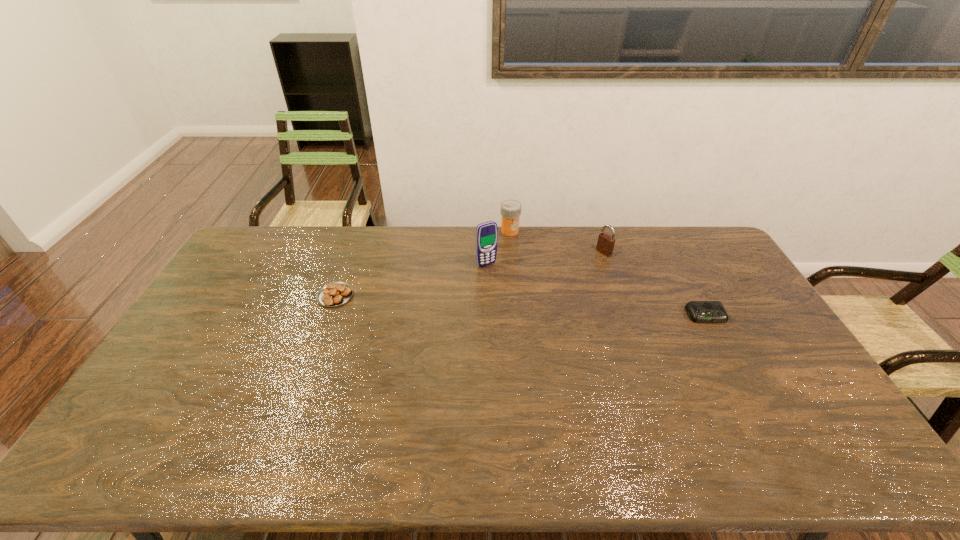
Where is `vacant region located 0.260m on the front-facing side of the padlock`? vacant region located 0.260m on the front-facing side of the padlock is located at coordinates (549, 284).

In order to click on blank space located 0.150m on the front-facing side of the padlock in this screenshot , I will do `click(571, 271)`.

Find the location of a particular element. Image resolution: width=960 pixels, height=540 pixels. vacant area located 0.260m on the front-facing side of the padlock is located at coordinates (549, 284).

This screenshot has height=540, width=960. Find the location of `vacant area located on the label side of the farthest object`. vacant area located on the label side of the farthest object is located at coordinates (517, 254).

Where is `free space located on the label side of the farthest object`? Image resolution: width=960 pixels, height=540 pixels. free space located on the label side of the farthest object is located at coordinates (524, 273).

This screenshot has width=960, height=540. Identify the location of vacant space positioned on the label side of the farthest object. (531, 292).

You are a GUI agent. You are given a task and a screenshot of the screen. Output one action in this format:
    pyautogui.click(x=<x>, y=<y>)
    Task: Click on the vacant space located 0.180m on the front-facing side of the cellular telephone
    This screenshot has height=540, width=960.
    Given the screenshot: What is the action you would take?
    pyautogui.click(x=515, y=300)

Locate an element on the screen. vacant space located 0.240m on the front-facing side of the cellular telephone is located at coordinates (523, 312).

You are a GUI agent. You are given a task and a screenshot of the screen. Output one action in this format:
    pyautogui.click(x=<x>, y=<y>)
    Task: Click on the free spot located 0.190m on the front-facing side of the cellular telephone
    The width and height of the screenshot is (960, 540).
    Given the screenshot: What is the action you would take?
    pyautogui.click(x=516, y=302)

Locate an element on the screen. The width and height of the screenshot is (960, 540). padlock that is at the far edge is located at coordinates (605, 245).